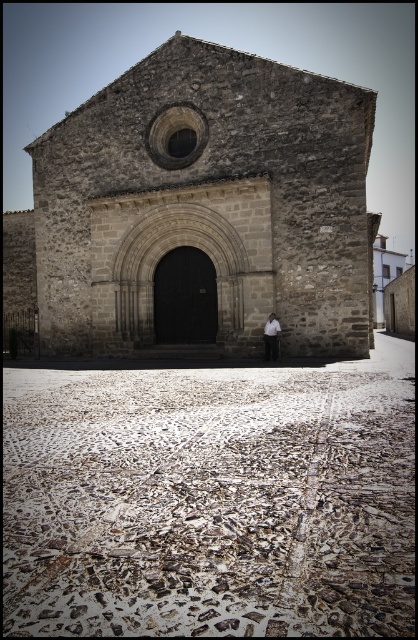
You are standing in front of the historic stone building and notice both the white textured cobblestone at lower center and the white cotton shirt at center. Which object is larger in size?

The white textured cobblestone at lower center is bigger than the white cotton shirt at center.

You are standing in the courtyard of the historic stone building and notice the white textured cobblestone at lower center and the white cotton shirt at center. Which object is closer to the ground?

The white textured cobblestone at lower center is closer to the ground as it is positioned below the white cotton shirt at center.